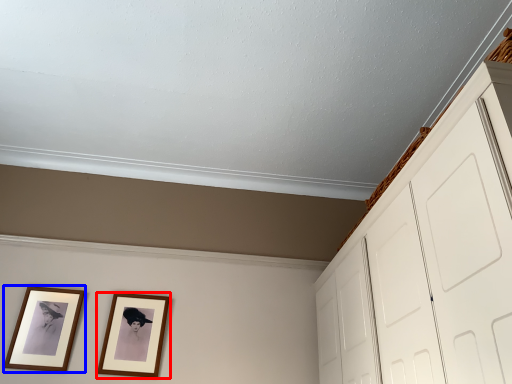
Question: Among these objects, which one is nearest to the camera, picture frame (highlighted by a red box) or picture frame (highlighted by a blue box)?

Choices:
 (A) picture frame
 (B) picture frame

Answer: (B)